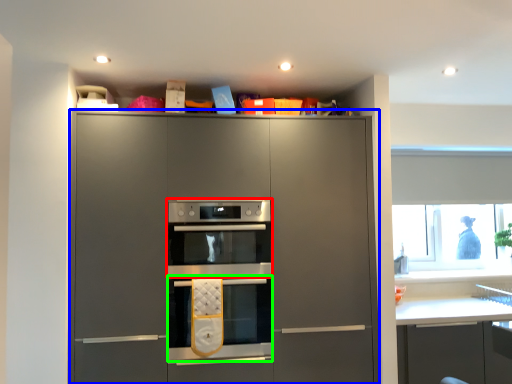
Question: Which object is positioned closest to oven (highlighted by a red box)? Select from cabinetry (highlighted by a blue box) and oven (highlighted by a green box).

Choices:
 (A) cabinetry
 (B) oven

Answer: (A)